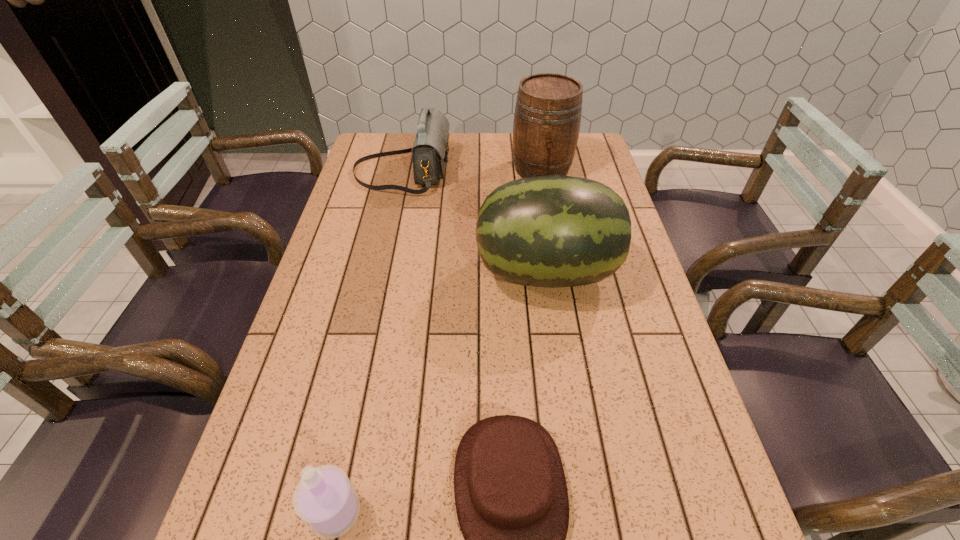
Where is `object that can be found as the second closest to the perfume`? This screenshot has width=960, height=540. object that can be found as the second closest to the perfume is located at coordinates (553, 231).